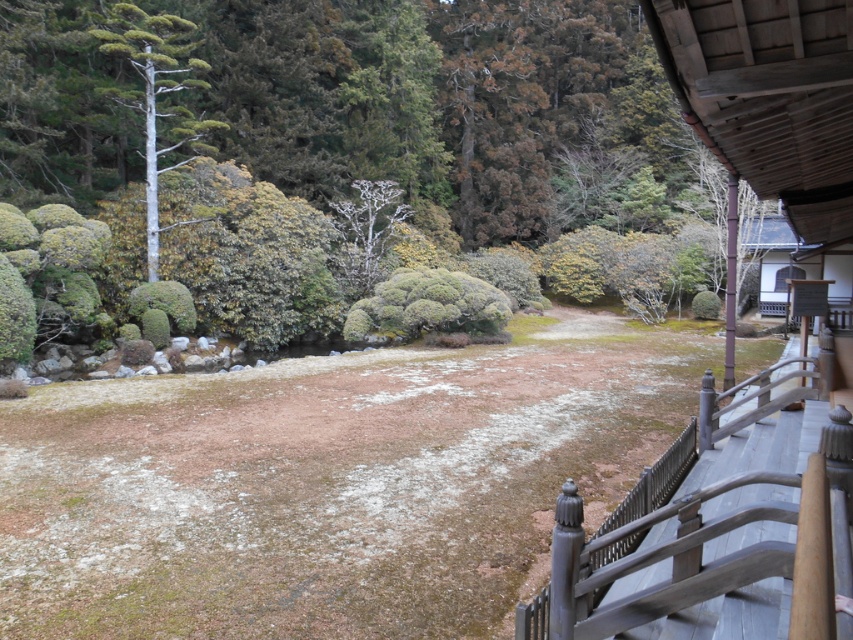
Based on the photo, you are standing on the wooden railing and looking down at the garden. There is a green textured bush at center and a bare white tree at center. Which object is located to the right of the other?

The green textured bush at center is positioned on the right side of the bare white tree at center.